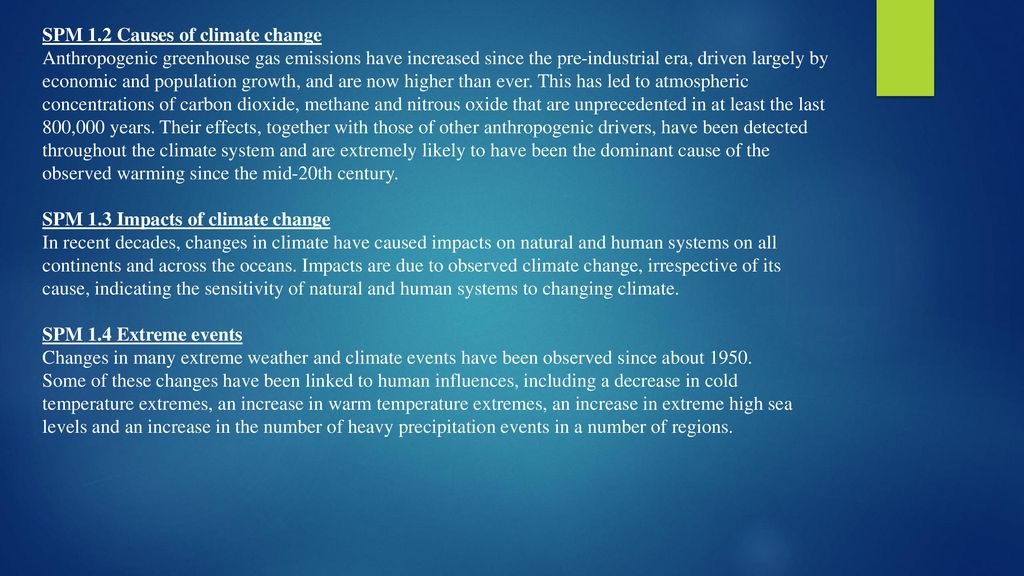
Find the location of a particular element. The height and width of the screenshot is (576, 1024). decoration is located at coordinates (901, 44).